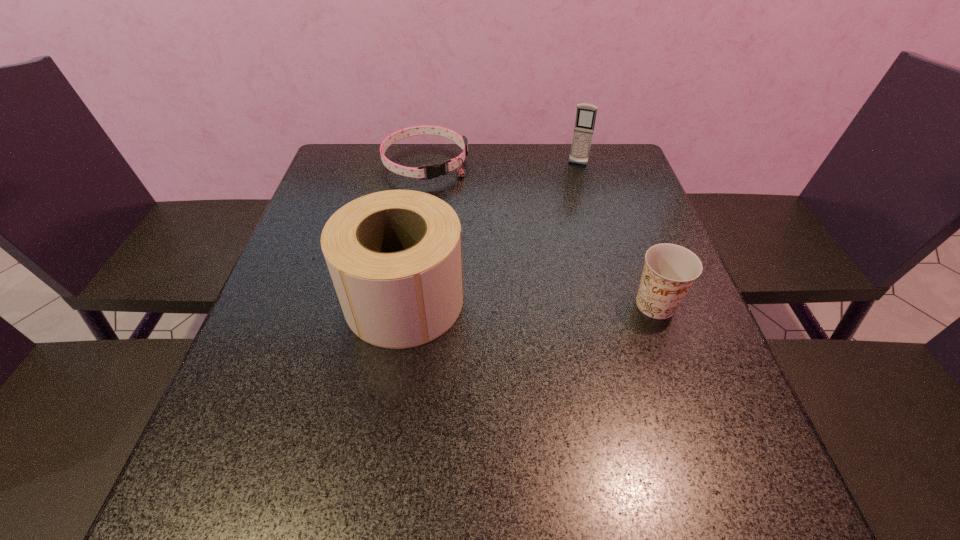
Identify the location of vacant space on the desktop that is between the toilet tissue and the Dixie cup and is positioned on the front-facing side of the cellular telephone. pyautogui.click(x=526, y=302).

At what (x,y) coordinates should I click in order to perform the action: click on vacant space on the desktop that is between the toilet tissue and the second shortest object and is positioned with the buckle on the shortest object. Please return your answer as a coordinate pair (x, y). Looking at the image, I should click on (519, 302).